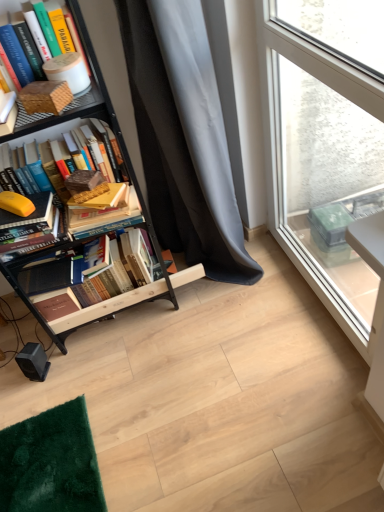
Find the location of a particular element. free spot above matte orange book at left, which appears as the 2th book when ordered from the bottom (from a real-world perspective) is located at coordinates (23, 204).